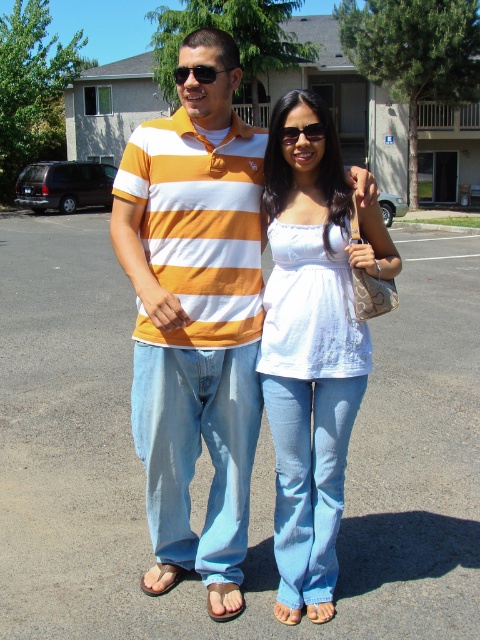
You are a photographer setting up a shoot in the parking lot. You need to position a camera to capture both the matte striped polo shirt at center and the black plastic sunglasses at center. Based on their positions, which object should be placed to the right in your frame?

The black plastic sunglasses at center should be placed to the right in your frame because the matte striped polo shirt at center is to the left of the black plastic sunglasses at center.

You are a photographer trying to capture a closeup of the brown suede sandal at lower center marked by point (222, 602). The photographer is standing at the position of the person on the left. Which direction should you move to get closer to the sandal?

The photographer should move to the right to get closer to the brown suede sandal at lower center marked by point (222, 602).

You are a fashion designer observing two items in the image. The first item is the matte striped polo shirt at center, and the second is the brown leather sandal at lower center. Which of these two items is bigger in size?

The matte striped polo shirt at center is larger in size compared to the brown leather sandal at lower center according to the description.